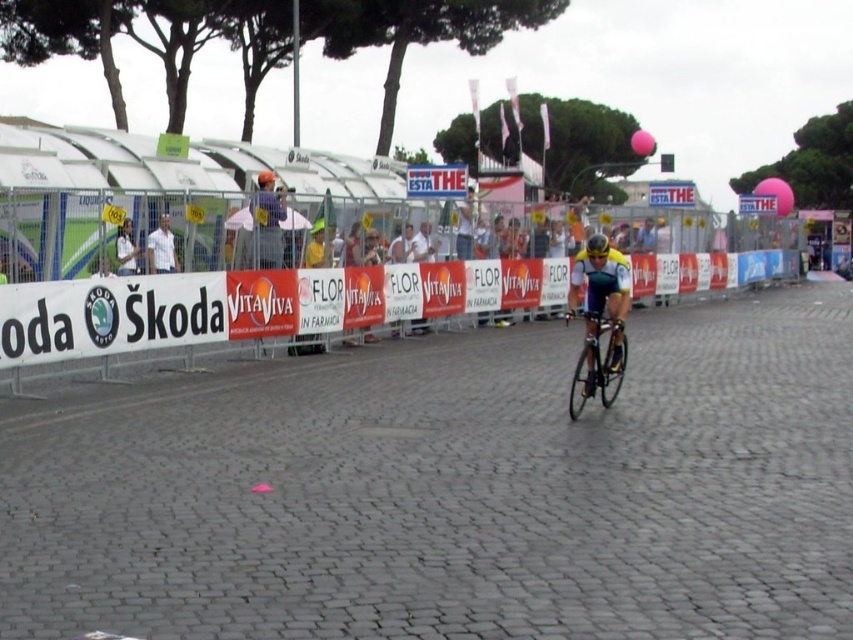
Question: Which point is closer to the camera?

Choices:
 (A) (602, 392)
 (B) (122, 232)
 (C) (596, 236)

Answer: (C)

Question: Can you confirm if white shirt at left is wider than white fabric shirt at left?

Choices:
 (A) yes
 (B) no

Answer: (A)

Question: Which point is closer to the camera?

Choices:
 (A) white shirt at left
 (B) yellow matte bicycle helmet at center
 (C) white plastic barrier at center
 (D) shiny metallic bicycle at center

Answer: (D)

Question: Can you confirm if yellow-green jersey at center is bigger than white shirt at left?

Choices:
 (A) yes
 (B) no

Answer: (B)

Question: Which point is farther from the camera taking this photo?

Choices:
 (A) (601, 234)
 (B) (129, 275)

Answer: (A)

Question: Does white plastic barrier at center appear on the right side of yellow-green jersey at center?

Choices:
 (A) no
 (B) yes

Answer: (B)